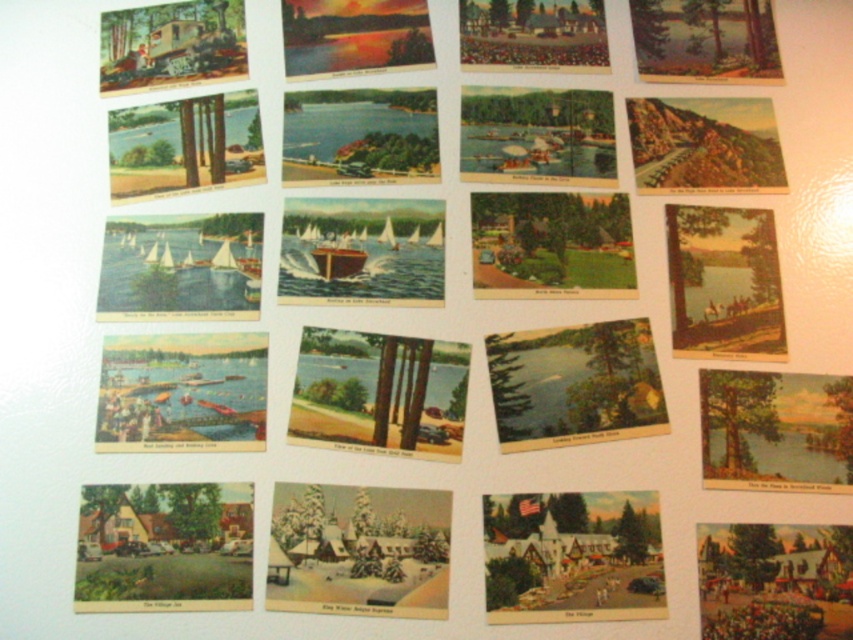
You are examining a vintage postcard collection arranged in a grid. You notice a matte green house at bottom left and a matte brown tree at upper right. Which object appears closer to you in the arrangement?

The matte green house at bottom left appears closer to the viewer than the matte brown tree at upper right.